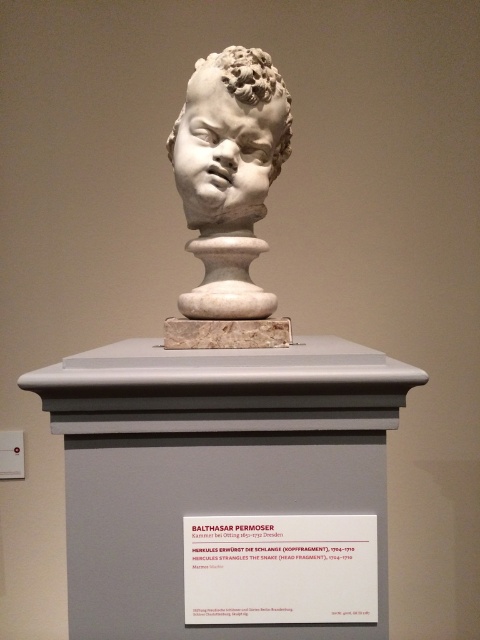
You are an art curator planning to display both the white marble bust at center and the white marble head at center in a new exhibition. Given their sizes, which one should be placed on the pedestal to ensure it is the focal point of the display?

The white marble bust at center is bigger than the white marble head at center, so placing the white marble bust at center on the pedestal will make it the focal point of the display.

You are an art student standing in front of the sculpture. You notice two parts of the sculpture labeled as the white marble bust at center and the white marble head at center. Which part is closer to you?

The white marble bust at center is closer to you because it is in front of the white marble head at center.